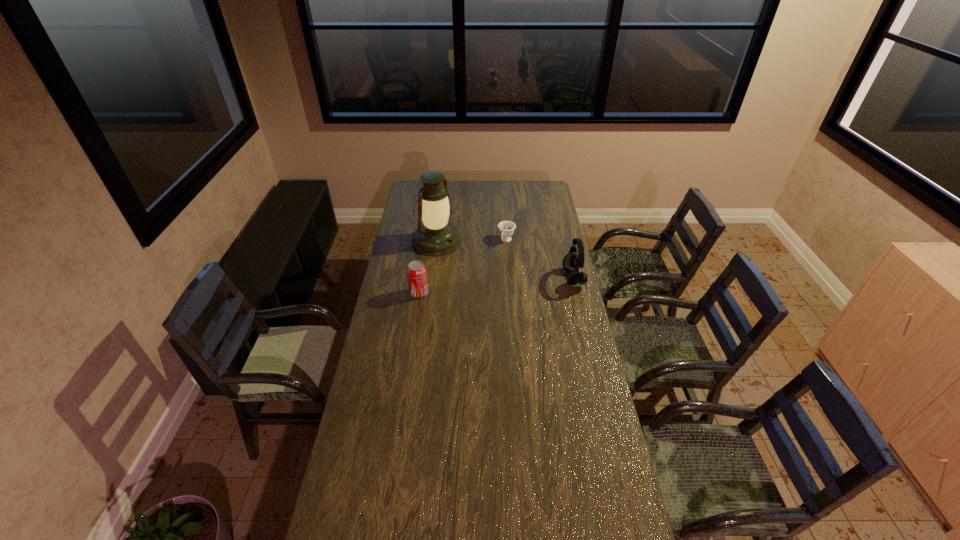
The height and width of the screenshot is (540, 960). Identify the location of free spot on the desktop that is between the third tallest object and the headset and is positioned on the side of the shortest object with the handle. (476, 287).

Identify the location of vacant space on the desktop that is between the soda can and the rightmost object and is positioned with the light compartment facing forward on the tallest object. The image size is (960, 540). (517, 284).